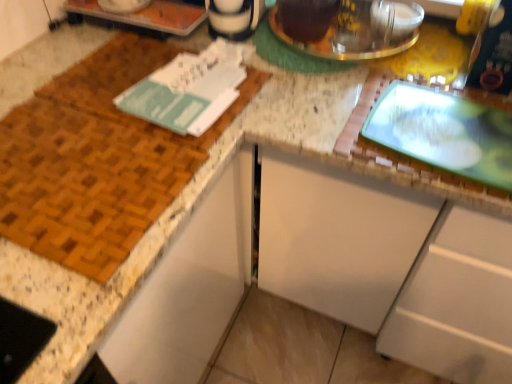
Where is `white matte cabinet at center`? The image size is (512, 384). white matte cabinet at center is located at coordinates (390, 266).

Measure the distance between point (375, 40) and camera.

Point (375, 40) and camera are 1.05 meters apart from each other.

The width and height of the screenshot is (512, 384). I want to click on white matte cabinet at center, so click(x=390, y=266).

Is teal paper journal at upper left oriented towards white matte cabinet at center?

No.

Can we say teal paper journal at upper left lies outside white matte cabinet at center?

Yes.

Between teal paper journal at upper left and white matte cabinet at center, which one has smaller size?

teal paper journal at upper left.

Between white matte cabinet at center and teal paper journal at upper left, which one appears on the left side from the viewer's perspective?

Positioned to the left is teal paper journal at upper left.

Which of these two, white matte cabinet at center or teal paper journal at upper left, is bigger?

Bigger between the two is white matte cabinet at center.

In the image, is white matte cabinet at center positioned in front of or behind teal paper journal at upper left?

Clearly, white matte cabinet at center is in front of teal paper journal at upper left.

Is white matte cabinet at center inside the boundaries of teal paper journal at upper left, or outside?

white matte cabinet at center is not enclosed by teal paper journal at upper left.

From the image's perspective, which one is positioned higher, white matte cabinet at center or shiny metallic kettle at upper center?

shiny metallic kettle at upper center, from the image's perspective.

Between white matte cabinet at center and shiny metallic kettle at upper center, which one is positioned behind?

Positioned behind is shiny metallic kettle at upper center.

Looking at this image, does white matte cabinet at center have a larger size compared to shiny metallic kettle at upper center?

Yes.

The width and height of the screenshot is (512, 384). I want to click on appliance below the teal paper journal at upper left (from a real-world perspective), so click(x=358, y=30).

Is the position of teal paper journal at upper left more distant than that of shiny metallic kettle at upper center?

That is False.

Consider the image. Considering the sizes of objects teal paper journal at upper left and shiny metallic kettle at upper center in the image provided, who is bigger, teal paper journal at upper left or shiny metallic kettle at upper center?

shiny metallic kettle at upper center is bigger.

Is teal paper journal at upper left facing towards shiny metallic kettle at upper center?

No, teal paper journal at upper left does not turn towards shiny metallic kettle at upper center.

Is point (364, 23) positioned in front of point (308, 303)?

Yes, it is.

Between shiny metallic kettle at upper center and white matte cabinet at center, which one has larger width?

white matte cabinet at center.

Which is in front, shiny metallic kettle at upper center or white matte cabinet at center?

white matte cabinet at center is more forward.

Is shiny metallic kettle at upper center situated inside teal paper journal at upper left or outside?

shiny metallic kettle at upper center is not inside teal paper journal at upper left, it's outside.

Between point (418, 9) and point (163, 100), which one is positioned in front?

The point (163, 100) is more forward.

Between shiny metallic kettle at upper center and teal paper journal at upper left, which one appears on the right side from the viewer's perspective?

shiny metallic kettle at upper center is more to the right.

At what (x,y) coordinates should I click in order to perform the action: click on appliance below the teal paper journal at upper left (from a real-world perspective). Please return your answer as a coordinate pair (x, y). The width and height of the screenshot is (512, 384). Looking at the image, I should click on (358, 30).

Locate an element on the screen. Image resolution: width=512 pixels, height=384 pixels. journal that is behind the white matte cabinet at center is located at coordinates (x=188, y=89).

At what (x,y) coordinates should I click in order to perform the action: click on cabinetry located on the right of teal paper journal at upper left. Please return your answer as a coordinate pair (x, y). This screenshot has width=512, height=384. Looking at the image, I should click on (390, 266).

When comparing their distances from white matte cabinet at center, does teal paper journal at upper left or shiny metallic kettle at upper center seem further?

shiny metallic kettle at upper center is further to white matte cabinet at center.

When comparing their distances from teal paper journal at upper left, does white matte cabinet at center or shiny metallic kettle at upper center seem further?

Based on the image, white matte cabinet at center appears to be further to teal paper journal at upper left.

From the image, which object appears to be nearer to white matte cabinet at center, shiny metallic kettle at upper center or teal paper journal at upper left?

teal paper journal at upper left.

From the image, which object appears to be nearer to shiny metallic kettle at upper center, teal paper journal at upper left or white matte cabinet at center?

Based on the image, teal paper journal at upper left appears to be nearer to shiny metallic kettle at upper center.

When comparing their distances from shiny metallic kettle at upper center, does white matte cabinet at center or teal paper journal at upper left seem closer?

Among the two, teal paper journal at upper left is located nearer to shiny metallic kettle at upper center.

Estimate the real-world distances between objects in this image. Which object is closer to teal paper journal at upper left, shiny metallic kettle at upper center or white matte cabinet at center?

shiny metallic kettle at upper center lies closer to teal paper journal at upper left than the other object.

Locate an element on the screen. The height and width of the screenshot is (384, 512). appliance between teal paper journal at upper left and white matte cabinet at center from left to right is located at coordinates (358, 30).